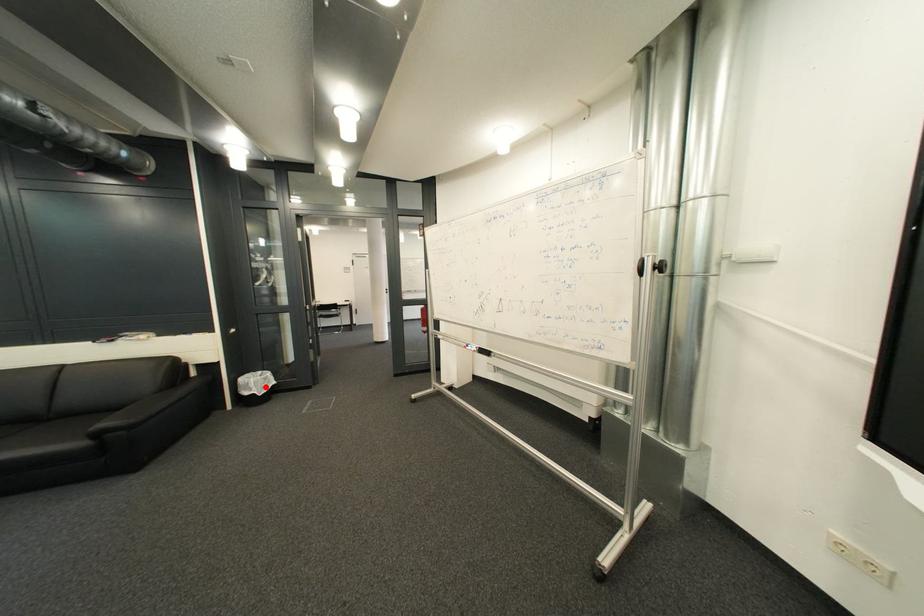
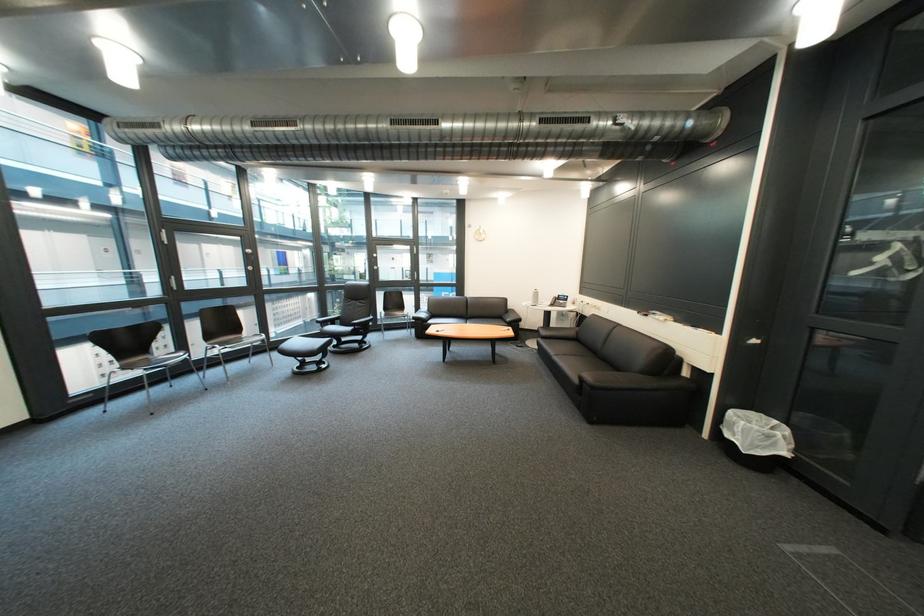
Question: I am providing you with two images of the same scene from different viewpoints. Given a red point in image1, look at the same physical point in image2. Is it:

Choices:
 (A) Closer to the viewpoint
 (B) Farther from the viewpoint

Answer: (B)